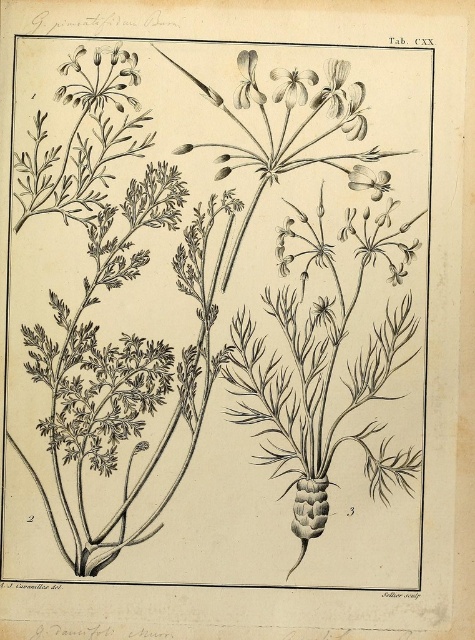
Where is `white delicate petals at upper center`? white delicate petals at upper center is located at coordinates (292, 84).

Is the position of white delicate petals at upper center less distant than that of white delicate petals at upper left?

No, it is behind white delicate petals at upper left.

You are a GUI agent. You are given a task and a screenshot of the screen. Output one action in this format:
    pyautogui.click(x=<x>, y=<y>)
    Task: Click on the white delicate petals at upper center
    This screenshot has width=475, height=640.
    Given the screenshot: What is the action you would take?
    (x=292, y=84)

Find the location of a particular element. white delicate petals at upper center is located at coordinates (292, 84).

Is point (248, 80) positioned behind point (370, 186)?

That is False.

Is smooth white petal at upper center below smooth white flower at upper right?

No, smooth white petal at upper center is not below smooth white flower at upper right.

What do you see at coordinates (247, 81) in the screenshot? This screenshot has width=475, height=640. I see `smooth white petal at upper center` at bounding box center [247, 81].

This screenshot has height=640, width=475. In order to click on smooth white petal at upper center in this screenshot , I will do `click(247, 81)`.

Who is taller, smooth white petal at upper center or white delicate petals at upper left?

smooth white petal at upper center

In the scene shown: Which is more to the right, smooth white petal at upper center or white delicate petals at upper left?

smooth white petal at upper center

Between point (252, 64) and point (75, 64), which one is positioned in front?

Point (75, 64) is more forward.

Where is `smooth white petal at upper center`? The height and width of the screenshot is (640, 475). smooth white petal at upper center is located at coordinates (247, 81).